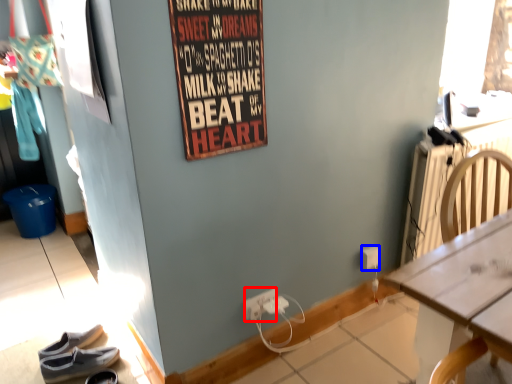
Question: Among these objects, which one is farthest to the camera, power outlet (highlighted by a red box) or power outlet (highlighted by a blue box)?

Choices:
 (A) power outlet
 (B) power outlet

Answer: (B)